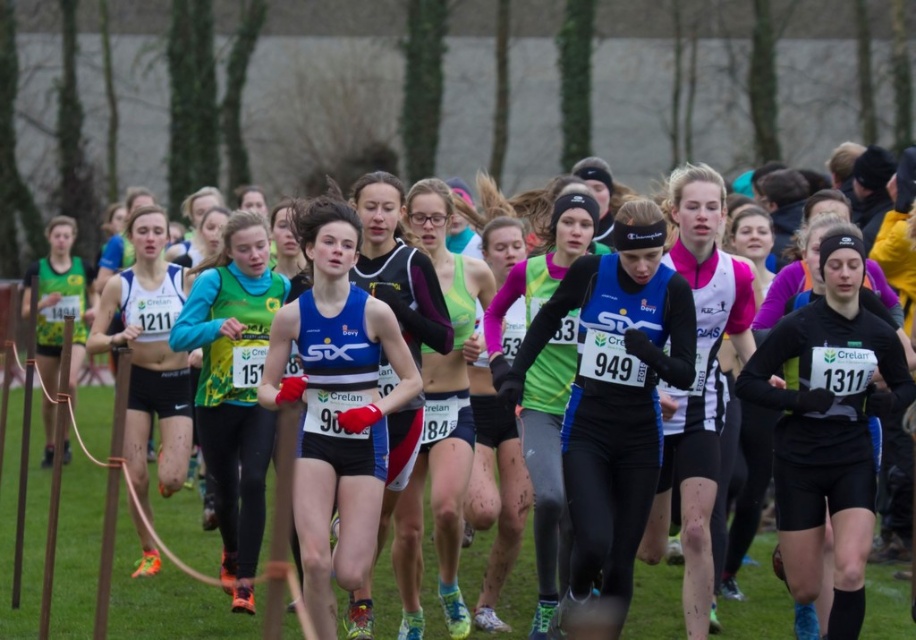
Who is positioned more to the right, blue synthetic tank top at center or black matte running suit at center?

Positioned to the right is black matte running suit at center.

Based on the photo, which is more to the left, blue synthetic tank top at center or black matte running suit at center?

blue synthetic tank top at center

The height and width of the screenshot is (640, 916). Identify the location of blue synthetic tank top at center. (336, 403).

Which of these two, blue synthetic tank top at center or matte blue running suit at center, stands taller?

blue synthetic tank top at center is taller.

Which is below, blue synthetic tank top at center or matte blue running suit at center?

Positioned lower is matte blue running suit at center.

Does point (333, 451) lie in front of point (544, 564)?

Yes, it is in front of point (544, 564).

The image size is (916, 640). I want to click on blue synthetic tank top at center, so click(x=336, y=403).

Is green jersey at center below matte black shorts at left?

Yes, green jersey at center is below matte black shorts at left.

Is point (238, 298) less distant than point (48, 355)?

Yes, it is.

Locate an element on the screen. green jersey at center is located at coordinates (234, 385).